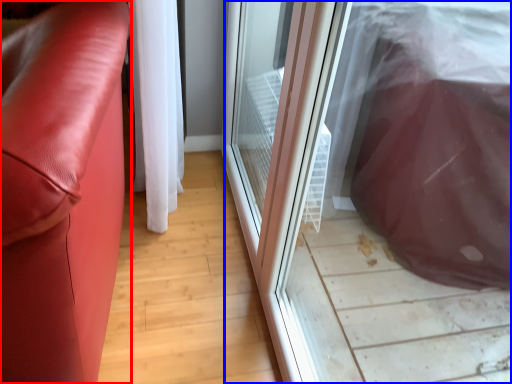
Question: Which object appears farthest to the camera in this image, furniture (highlighted by a red box) or screen door (highlighted by a blue box)?

Choices:
 (A) furniture
 (B) screen door

Answer: (A)